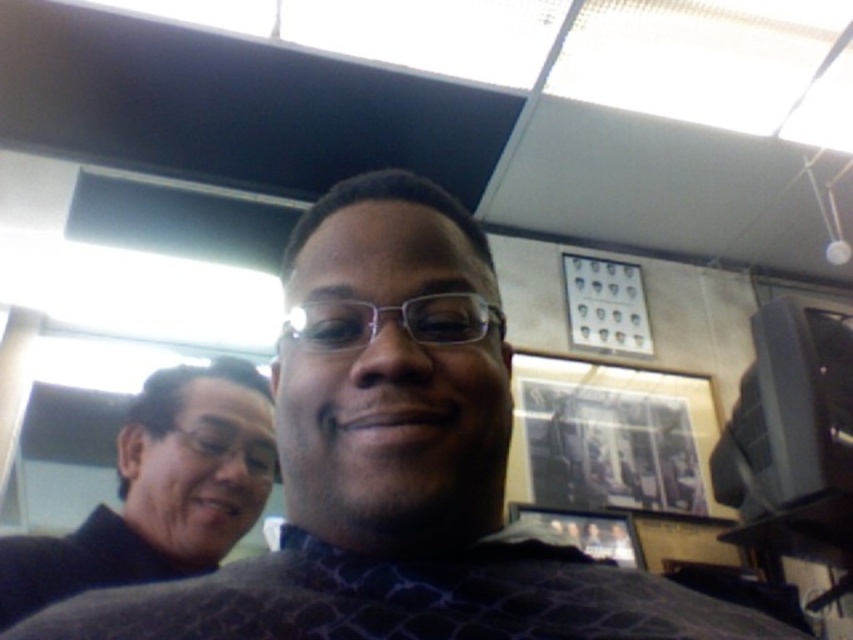
Question: Which object is closer to the camera taking this photo?

Choices:
 (A) black matte sweater at left
 (B) matte black shirt at center

Answer: (B)

Question: Does matte black shirt at center appear on the left side of black matte sweater at left?

Choices:
 (A) yes
 (B) no

Answer: (B)

Question: Is matte black shirt at center smaller than black matte sweater at left?

Choices:
 (A) yes
 (B) no

Answer: (B)

Question: Is matte black shirt at center bigger than black matte sweater at left?

Choices:
 (A) no
 (B) yes

Answer: (B)

Question: Which point is closer to the camera taking this photo?

Choices:
 (A) (434, 317)
 (B) (202, 486)

Answer: (A)